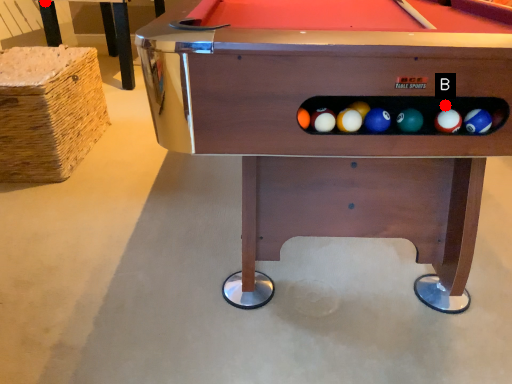
Question: Two points are circled on the image, labeled by A and B beside each circle. Which point is closer to the camera?

Choices:
 (A) A is closer
 (B) B is closer

Answer: (B)